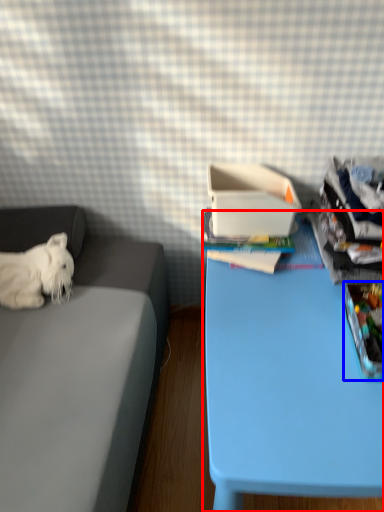
Question: Among these objects, which one is nearest to the camera, table (highlighted by a red box) or storage box (highlighted by a blue box)?

Choices:
 (A) table
 (B) storage box

Answer: (A)